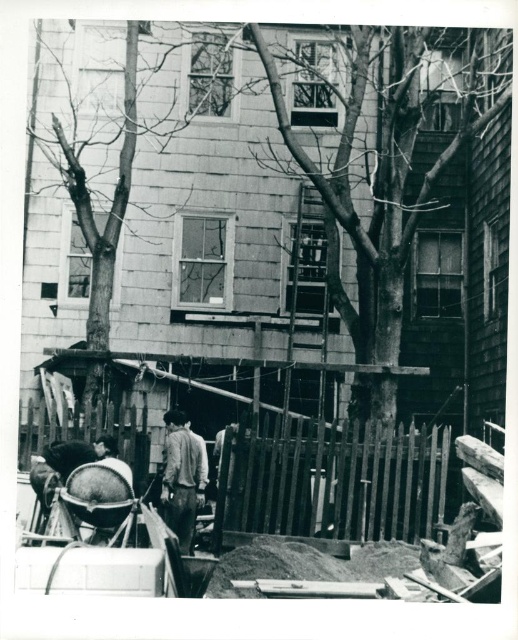
You are a construction worker who just arrived at the site. You see the wooden picket fence at lower center and the light brown leather jacket at center. Which object is higher up in the image?

The wooden picket fence at lower center is located above the light brown leather jacket at center, so the wooden picket fence at lower center is higher up in the image.

You are a construction worker who just arrived at the site. You see the wooden picket fence at lower center and the light brown leather jacket at center. Which object is shorter in height?

The wooden picket fence at lower center is shorter in height compared to the light brown leather jacket at center according to the description.

You are standing at the center of the image. Looking towards the bare wood tree at center, in which direction should you move to reach the wheelbarrow near the left side?

Since the wheelbarrow near the left side is located to the left of the bare wood tree at center, you should move to the left to reach it.